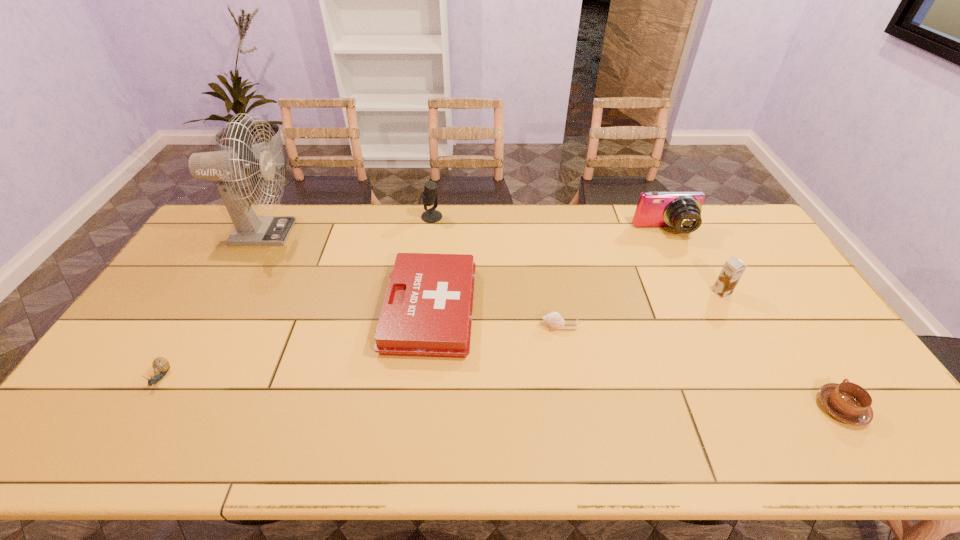
Identify the location of the tallest object. (230, 167).

In order to click on microphone in this screenshot , I will do `click(429, 197)`.

Find the location of a particular element. camera is located at coordinates (682, 210).

In order to click on chocolate milk in this screenshot , I will do `click(733, 269)`.

Image resolution: width=960 pixels, height=540 pixels. I want to click on the fifth tallest object, so click(x=427, y=312).

Where is `cappuccino`? cappuccino is located at coordinates (848, 402).

Locate an element on the screen. Image resolution: width=960 pixels, height=540 pixels. the right escargot is located at coordinates (553, 320).

At what (x,y) coordinates should I click in order to perform the action: click on the farther escargot. Please return your answer as a coordinate pair (x, y). The image size is (960, 540). Looking at the image, I should click on (553, 320).

Find the location of a particular element. The height and width of the screenshot is (540, 960). the nearer escargot is located at coordinates (160, 365).

Identify the location of free region located 0.130m on the air flow direction of the fan. The width and height of the screenshot is (960, 540). (329, 233).